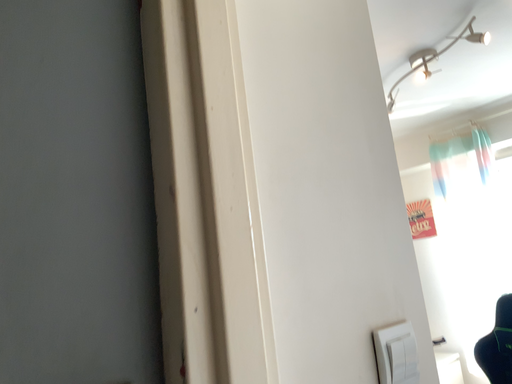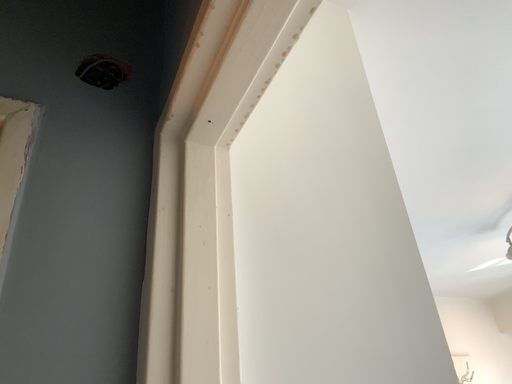
Question: How did the camera likely rotate when shooting the video?

Choices:
 (A) rotated downward
 (B) rotated upward

Answer: (B)